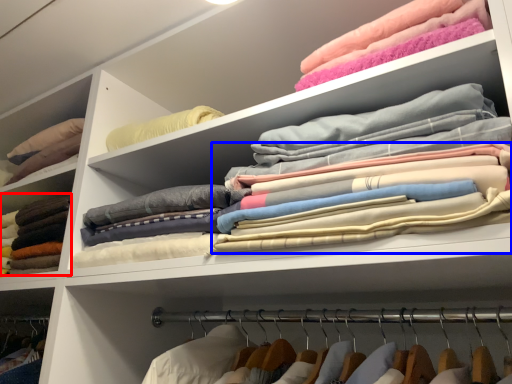
Question: Which point is further to the camera, clothing (highlighted by a red box) or clothing (highlighted by a blue box)?

Choices:
 (A) clothing
 (B) clothing

Answer: (A)